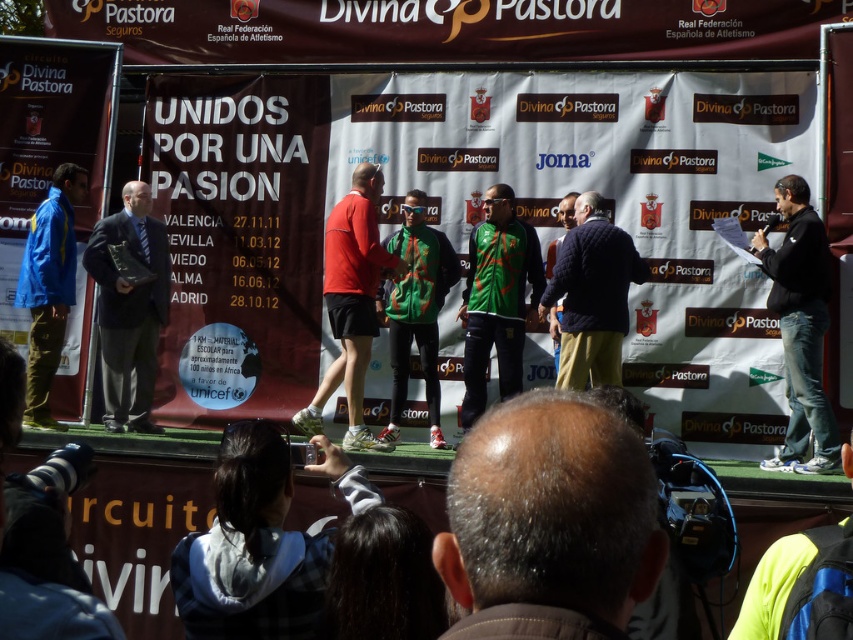
Which is in front, point (837, 573) or point (550, 250)?

Positioned in front is point (837, 573).

Which of these two, neon yellow jacket at lower right or navy blue sweater at center, stands shorter?

neon yellow jacket at lower right

Identify the location of neon yellow jacket at lower right. The image size is (853, 640). (801, 588).

Which is in front, point (541, 417) or point (45, 381)?

Point (541, 417)

Can you confirm if gray hair at center is smaller than blue fabric jacket at left?

Yes, gray hair at center is smaller than blue fabric jacket at left.

Is point (624, 458) less distant than point (36, 356)?

Yes, point (624, 458) is closer to viewer.

Where is `gray hair at center`? gray hair at center is located at coordinates point(550,522).

Between navy quilted jacket at center and blue fabric jacket at left, which one appears on the left side from the viewer's perspective?

From the viewer's perspective, blue fabric jacket at left appears more on the left side.

Where is `navy quilted jacket at center`? navy quilted jacket at center is located at coordinates (592, 296).